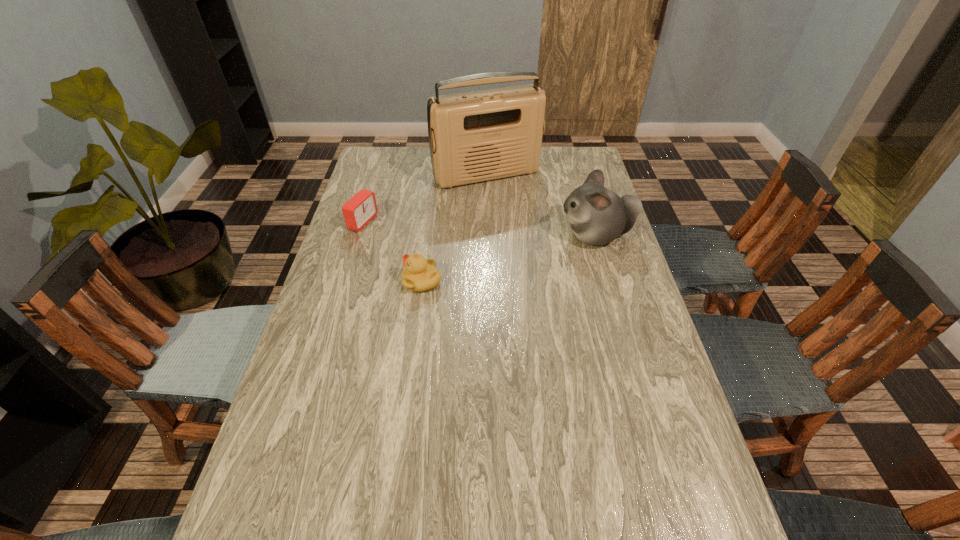
Where is `vacant space on the desktop that is between the nearest object and the rightmost object and is positioned on the front-facing side of the alarm clock`? This screenshot has width=960, height=540. vacant space on the desktop that is between the nearest object and the rightmost object and is positioned on the front-facing side of the alarm clock is located at coordinates (493, 262).

Find the location of `free space on the desktop that is between the nearest object and the hamster and is positioned on the front-facing side of the radio receiver`. free space on the desktop that is between the nearest object and the hamster and is positioned on the front-facing side of the radio receiver is located at coordinates (534, 252).